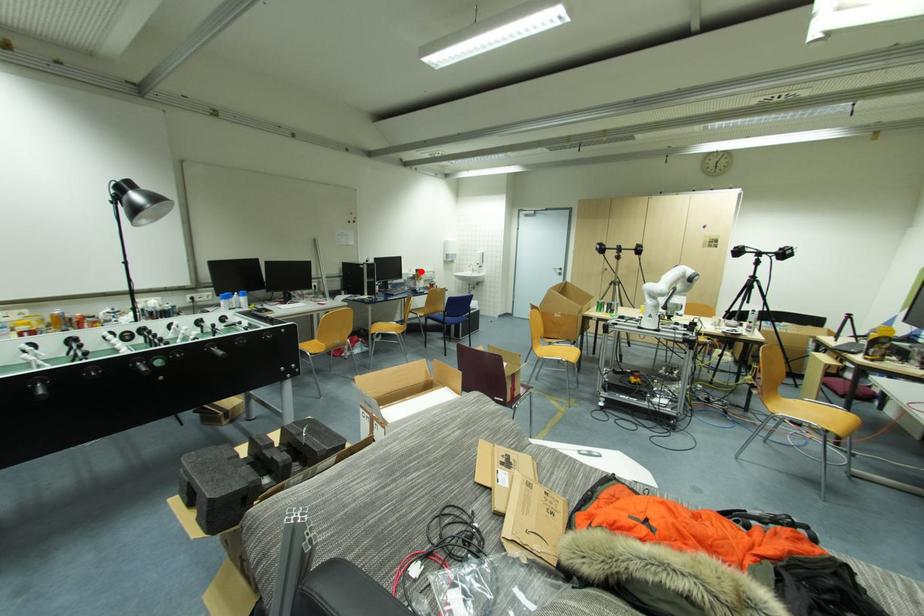
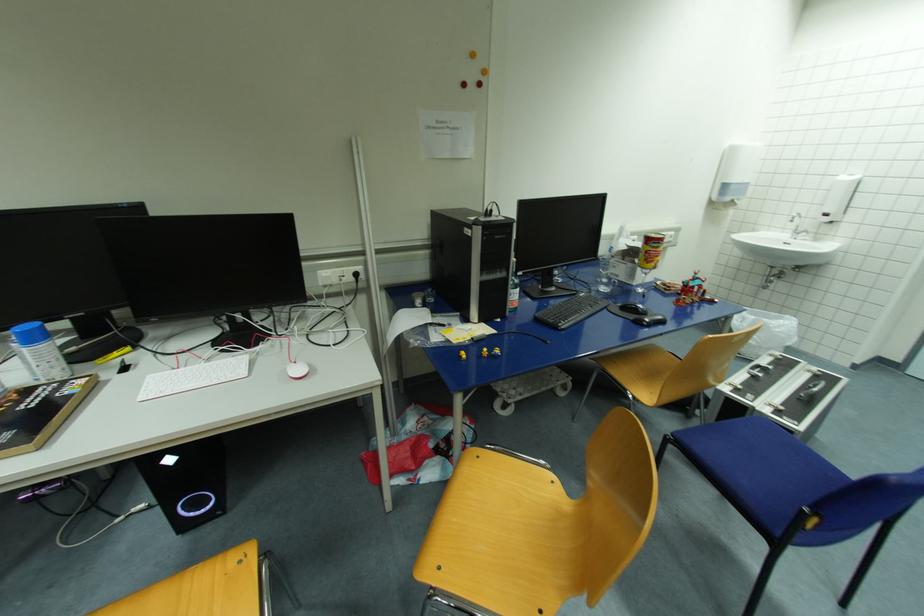
The point at the highlighted location is marked in the first image. Where is the corresponding point in the second image?

(653, 241)